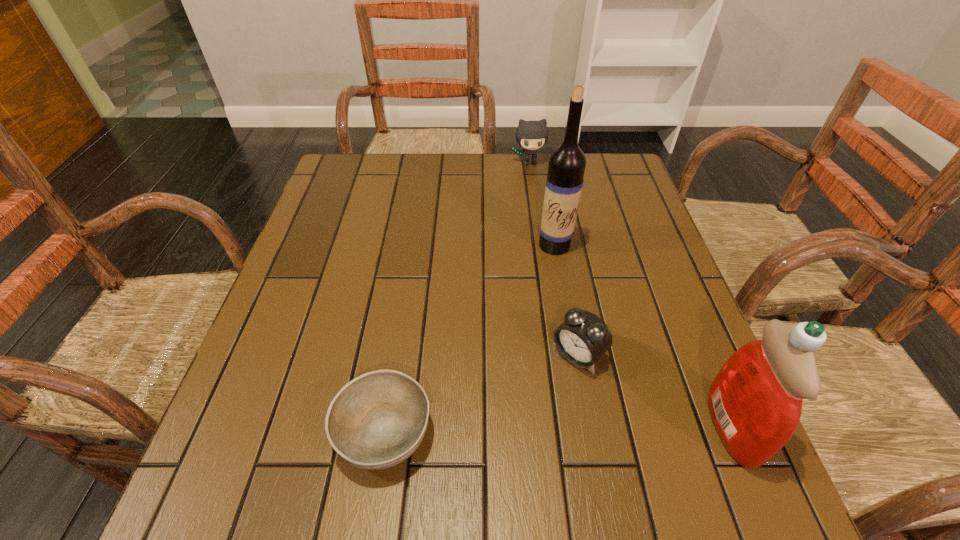
This screenshot has height=540, width=960. I want to click on the leftmost object, so click(x=377, y=420).

This screenshot has width=960, height=540. In order to click on bowl in this screenshot , I will do `click(377, 420)`.

Identify the location of the rightmost object. (755, 401).

This screenshot has width=960, height=540. In order to click on detergent in this screenshot , I will do `click(755, 401)`.

This screenshot has width=960, height=540. Identify the location of the second farthest object. (566, 167).

Identify the location of the tallest object. The height and width of the screenshot is (540, 960). (566, 167).

Image resolution: width=960 pixels, height=540 pixels. In order to click on kitten in this screenshot , I will do `click(531, 135)`.

What are the coordinates of `the third shortest object` in the screenshot? It's located at (531, 135).

Locate an element on the screen. the third nearest object is located at coordinates (582, 338).

I want to click on alarm clock, so click(582, 338).